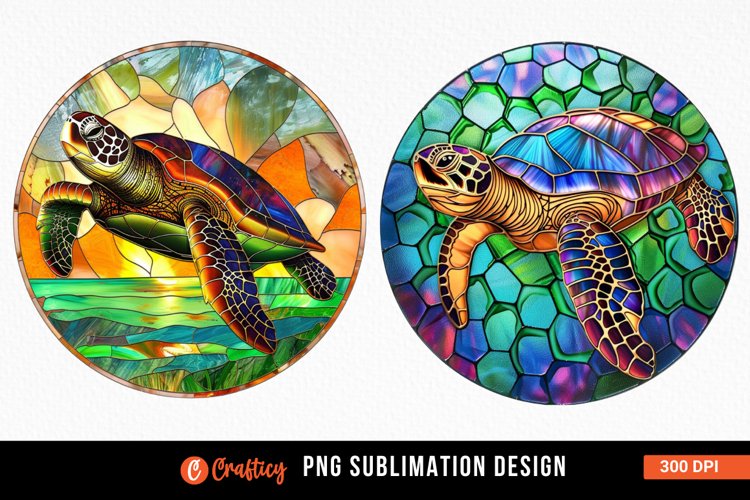
Image resolution: width=750 pixels, height=500 pixels. What are the coordinates of `scales` in the screenshot? It's located at (622, 304), (616, 272).